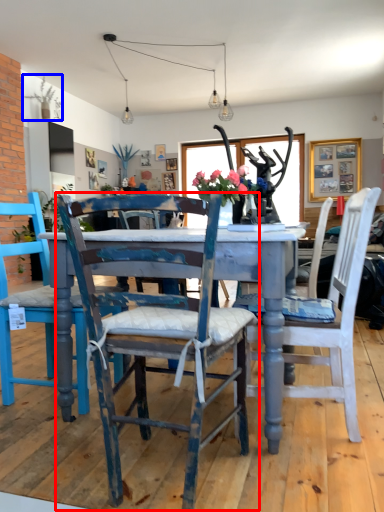
Question: Which object appears closest to the camera in this image, chair (highlighted by a red box) or plant (highlighted by a blue box)?

Choices:
 (A) chair
 (B) plant

Answer: (A)